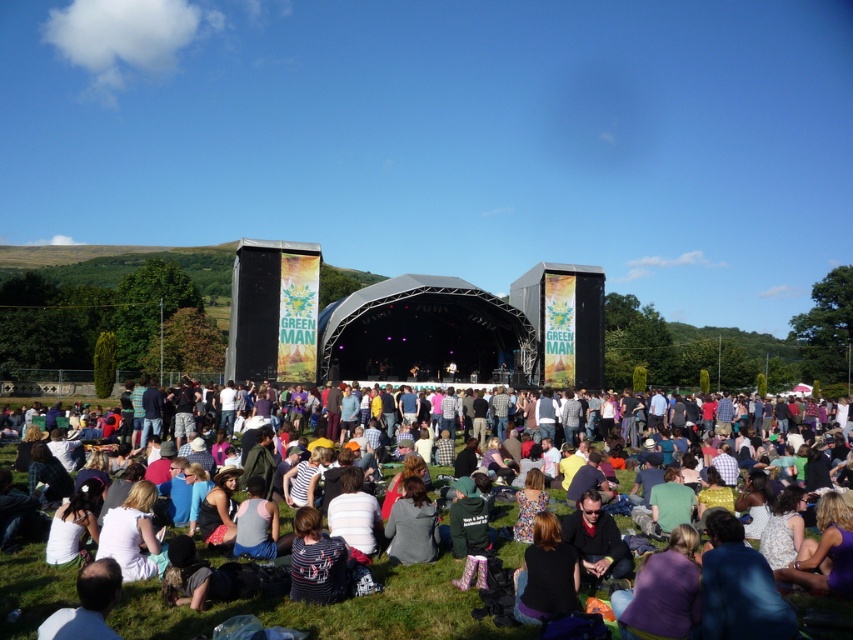
From the picture: You are a photographer at the festival and need to capture a group photo of the black fabric jacket at lower center and the striped fabric shirt at lower center. If you want to ensure both are fully visible in the frame without cropping, which one should you position closer to the center of the camera lens?

The black fabric jacket at lower center has a smaller width than the striped fabric shirt at lower center. To ensure both are fully visible without cropping, position the striped fabric shirt at lower center closer to the center of the camera lens since it is wider and requires more space in the frame.

You are a photographer at the music festival, and you want to capture a photo of both the white cotton shirt at lower center and the black fabric jacket at lower center in the same frame. Based on their positions, which clothing item is positioned more to the left?

The white cotton shirt at lower center is positioned more to the left than the black fabric jacket at lower center.

You are a photographer at the music festival and want to take a photo of both the black fabric jacket at lower center and the dark gray sweater at center. However, you notice that one of them is partially blocking the other. Which clothing item is taller and might be blocking the other?

The black fabric jacket at lower center is taller than the dark gray sweater at center, so it might be blocking the other.